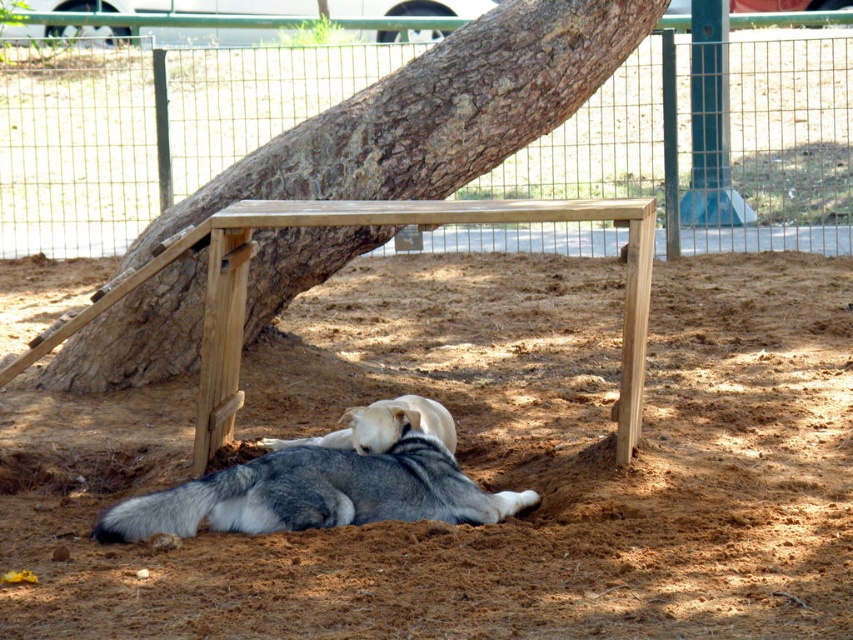
Where is `brown sandy dirt at center`? brown sandy dirt at center is located at coordinates (486, 465).

Is brown sandy dirt at center to the left of gray fur dog at center from the viewer's perspective?

In fact, brown sandy dirt at center is to the right of gray fur dog at center.

This screenshot has height=640, width=853. In order to click on brown sandy dirt at center in this screenshot , I will do `click(486, 465)`.

Find the location of `brown sandy dirt at center`. brown sandy dirt at center is located at coordinates (486, 465).

How distant is green wire mesh at upper center from light brown fur at center?

green wire mesh at upper center and light brown fur at center are 6.89 meters apart from each other.

Does green wire mesh at upper center have a lesser height compared to light brown fur at center?

Incorrect, green wire mesh at upper center's height does not fall short of light brown fur at center's.

Who is more distant from viewer, (521, 163) or (401, 396)?

Positioned behind is point (521, 163).

Image resolution: width=853 pixels, height=640 pixels. I want to click on green wire mesh at upper center, so click(x=149, y=132).

Is green wire mesh at upper center positioned before gray fur dog at center?

That is False.

Is point (541, 186) closer to viewer compared to point (405, 464)?

That is False.

At what (x,y) coordinates should I click in order to perform the action: click on green wire mesh at upper center. Please return your answer as a coordinate pair (x, y). The height and width of the screenshot is (640, 853). Looking at the image, I should click on (149, 132).